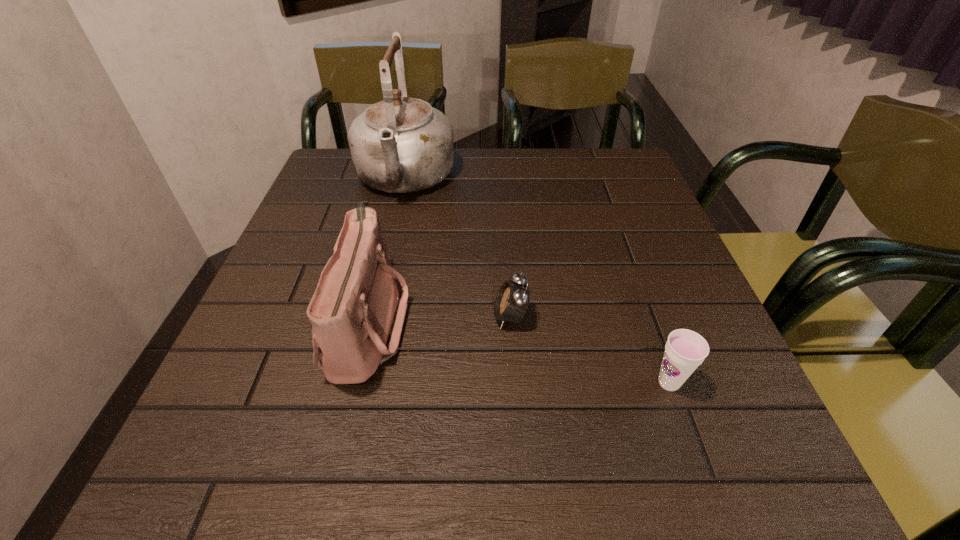
Find the location of a particular element. the tallest object is located at coordinates (399, 145).

The image size is (960, 540). In order to click on kettle in this screenshot , I will do `click(399, 145)`.

You are a GUI agent. You are given a task and a screenshot of the screen. Output one action in this format:
    pyautogui.click(x=<x>, y=<y>)
    Task: Click on the shoulder bag
    The image size is (960, 540).
    Given the screenshot: What is the action you would take?
    pyautogui.click(x=357, y=315)

The height and width of the screenshot is (540, 960). In order to click on the rightmost object in this screenshot , I will do tap(685, 350).

Where is `alarm clock`? alarm clock is located at coordinates (511, 303).

Identify the location of free space located 0.180m at the spout of the kettle. The width and height of the screenshot is (960, 540). (385, 267).

Locate an element on the screen. The height and width of the screenshot is (540, 960). vacant area situated on the front pocket of the shoulder bag is located at coordinates (493, 322).

Locate an element on the screen. vacant region located 0.230m on the back of the rightmost object is located at coordinates (631, 274).

This screenshot has width=960, height=540. Identify the location of blank area located 0.160m on the face of the second object from right to left. (409, 317).

Locate an element on the screen. vacant region located on the face of the second object from right to left is located at coordinates (456, 317).